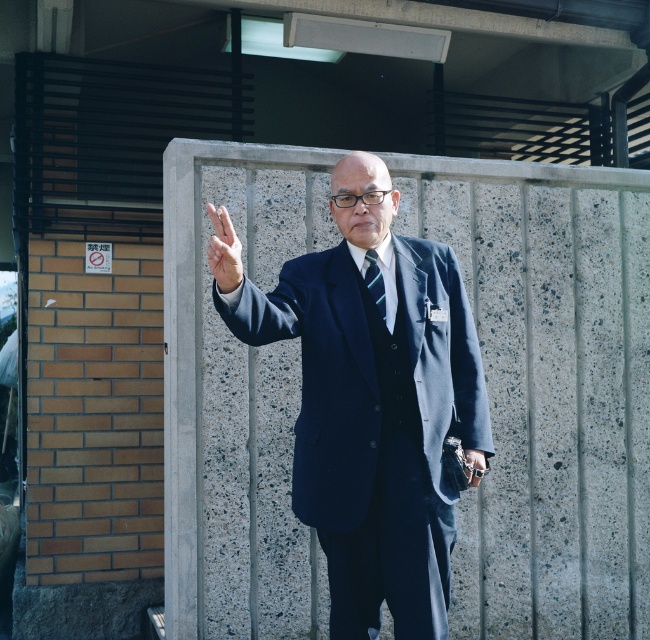
Question: Is navy blue suit at center further to the viewer compared to metallic silver watch at lower right?

Choices:
 (A) no
 (B) yes

Answer: (A)

Question: Among these points, which one is farthest from the camera?

Choices:
 (A) (378, 310)
 (B) (443, 256)
 (C) (465, 458)
 (D) (226, 280)

Answer: (B)

Question: Does green striped tie at center have a greater width compared to metallic silver watch at lower right?

Choices:
 (A) no
 (B) yes

Answer: (A)

Question: Among these objects, which one is nearest to the camera?

Choices:
 (A) matte black hand at center
 (B) navy blue suit at center

Answer: (A)

Question: Where is matte black hand at center located in relation to green striped tie at center in the image?

Choices:
 (A) left
 (B) right

Answer: (A)

Question: Which is farther from the green striped tie at center?

Choices:
 (A) navy blue suit at center
 (B) matte black hand at center
 (C) metallic silver watch at lower right

Answer: (B)